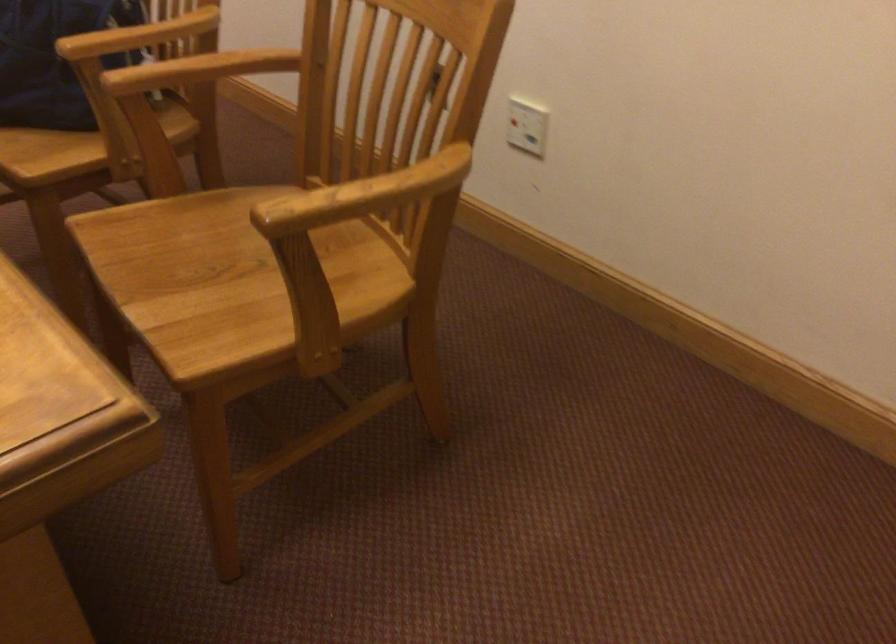
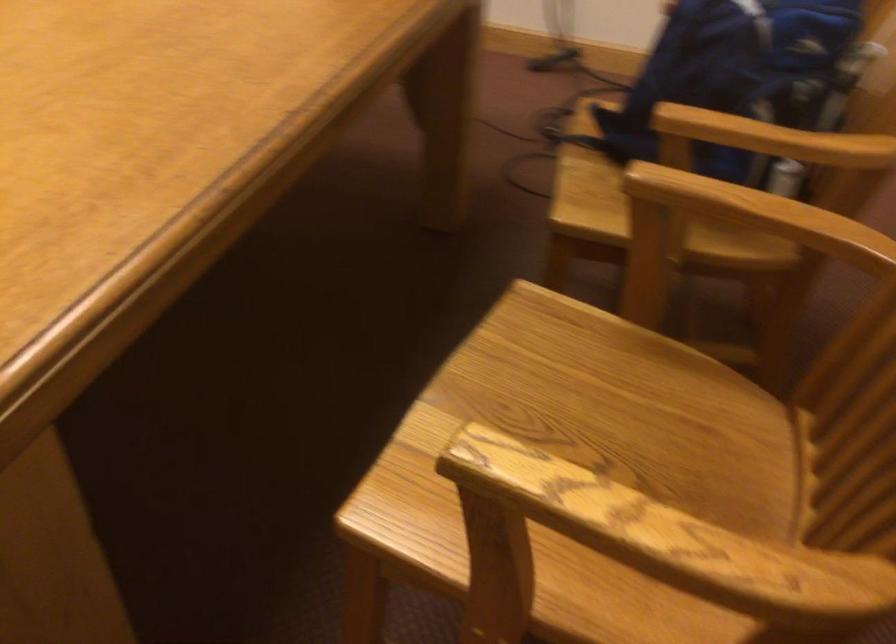
Locate, in the second image, the point that corresponds to the point at 204,73 in the first image.

(743, 223)